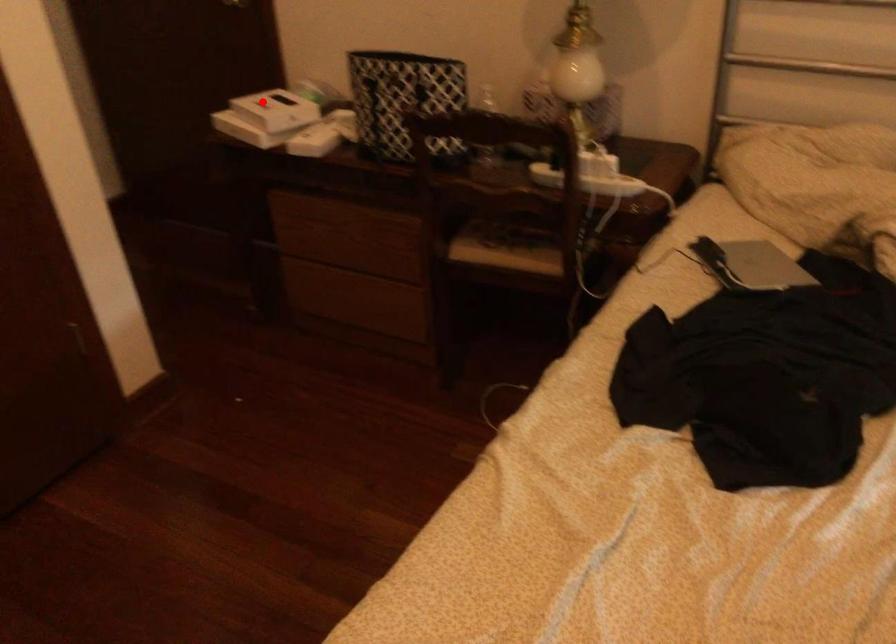
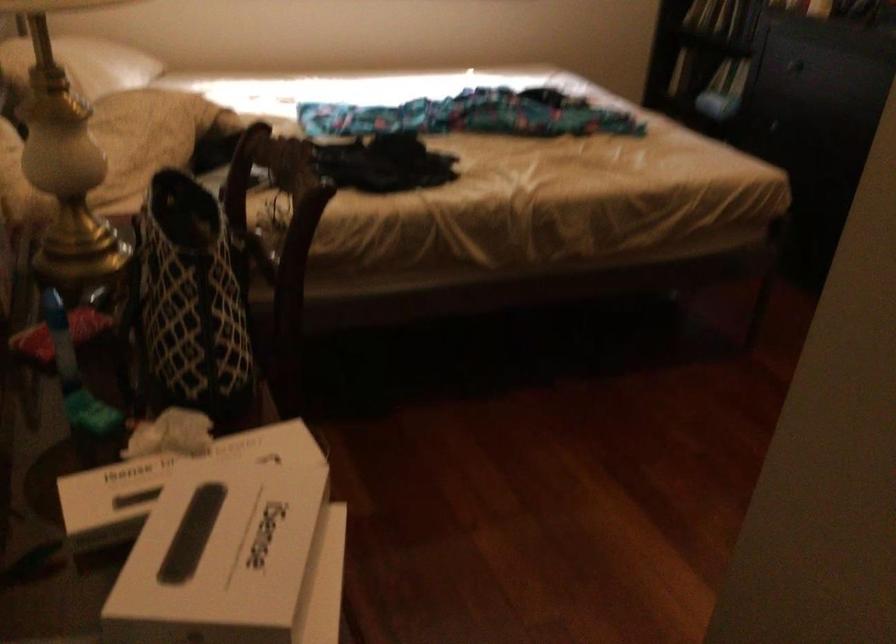
Find the pixel in the second image that matches the highlighted location in the first image.

(234, 560)